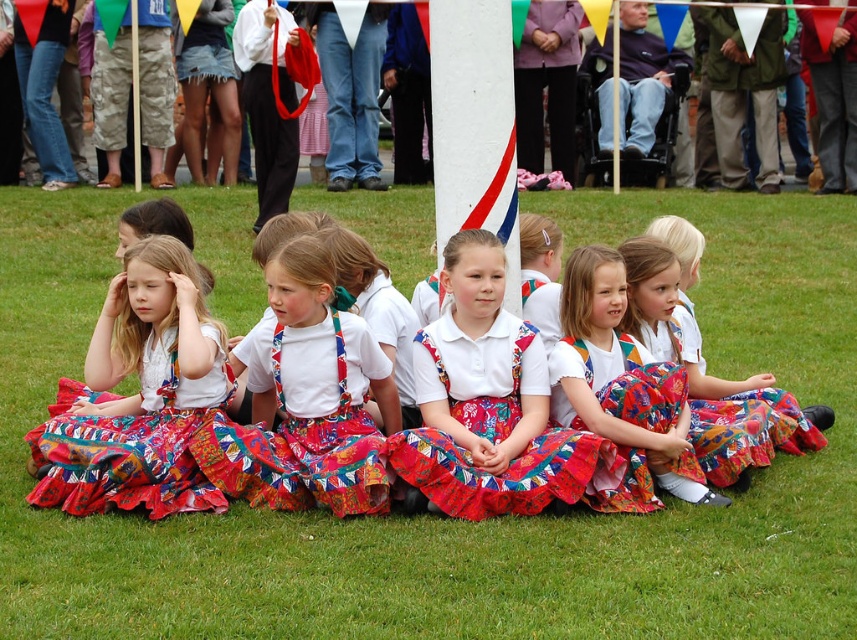
From the picture: Can you confirm if green grass at center is positioned above floral cotton dress at center?

Indeed, green grass at center is positioned over floral cotton dress at center.

Can you confirm if green grass at center is shorter than floral cotton dress at center?

No.

Is point (520, 557) farther from camera compared to point (535, 420)?

No, (520, 557) is in front of (535, 420).

At what (x,y) coordinates should I click in order to perform the action: click on green grass at center. Please return your answer as a coordinate pair (x, y). The height and width of the screenshot is (640, 857). Looking at the image, I should click on (452, 518).

Which is in front, point (494, 243) or point (580, 316)?

Point (494, 243)

Is floral cotton dress at center shorter than multicolored fabric dress at center?

No, floral cotton dress at center is not shorter than multicolored fabric dress at center.

Is point (538, 422) closer to viewer compared to point (655, 392)?

No, (538, 422) is behind (655, 392).

Identify the location of floral cotton dress at center. Image resolution: width=857 pixels, height=640 pixels. (490, 404).

Consider the image. Which of these two, green grass at center or multicolored fabric dress at center, stands taller?

green grass at center is taller.

Can you confirm if green grass at center is wider than multicolored fabric dress at center?

Indeed, green grass at center has a greater width compared to multicolored fabric dress at center.

At what (x,y) coordinates should I click in order to perform the action: click on green grass at center. Please return your answer as a coordinate pair (x, y). Looking at the image, I should click on (452, 518).

The width and height of the screenshot is (857, 640). Identify the location of green grass at center. (452, 518).